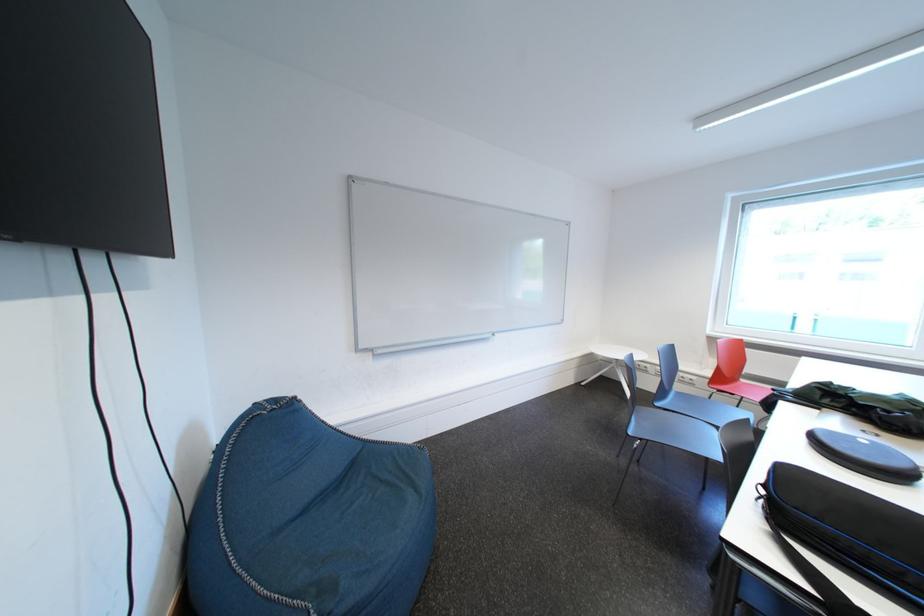
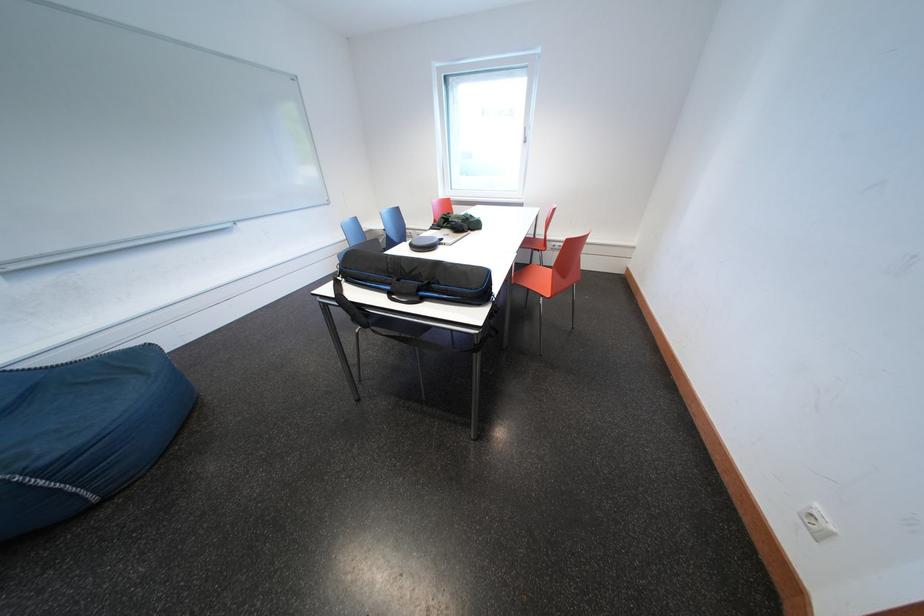
In the second image, find the point that corresponds to (397,351) in the first image.

(39, 262)